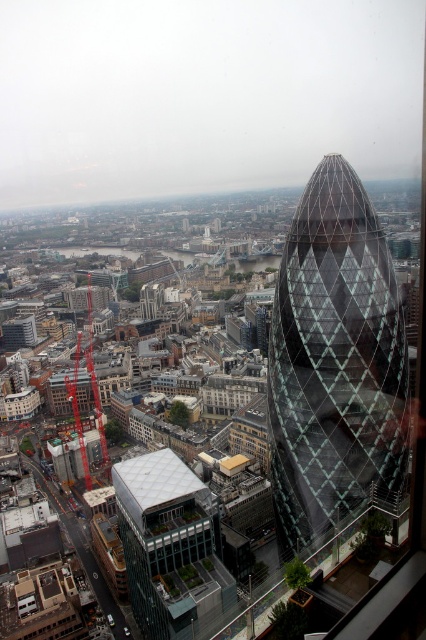
Question: Among these objects, which one is farthest from the camera?

Choices:
 (A) transparent glass tower at center right
 (B) clear glass windows at center

Answer: (B)

Question: Among these objects, which one is farthest from the camera?

Choices:
 (A) transparent glass tower at center right
 (B) clear glass windows at center

Answer: (B)

Question: Is transparent glass tower at center right to the right of clear glass windows at center from the viewer's perspective?

Choices:
 (A) yes
 (B) no

Answer: (A)

Question: Is transparent glass tower at center right to the right of clear glass windows at center from the viewer's perspective?

Choices:
 (A) no
 (B) yes

Answer: (B)

Question: Is transparent glass tower at center right closer to the viewer compared to clear glass windows at center?

Choices:
 (A) no
 (B) yes

Answer: (B)

Question: Which object appears closest to the camera in this image?

Choices:
 (A) transparent glass tower at center right
 (B) clear glass windows at center

Answer: (A)